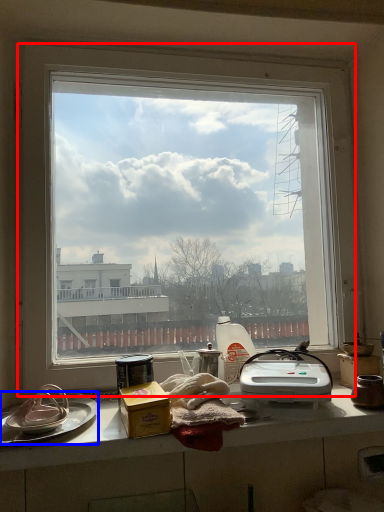
Question: Which of the following is the farthest to the observer, window (highlighted by a red box) or platter (highlighted by a blue box)?

Choices:
 (A) window
 (B) platter

Answer: (A)